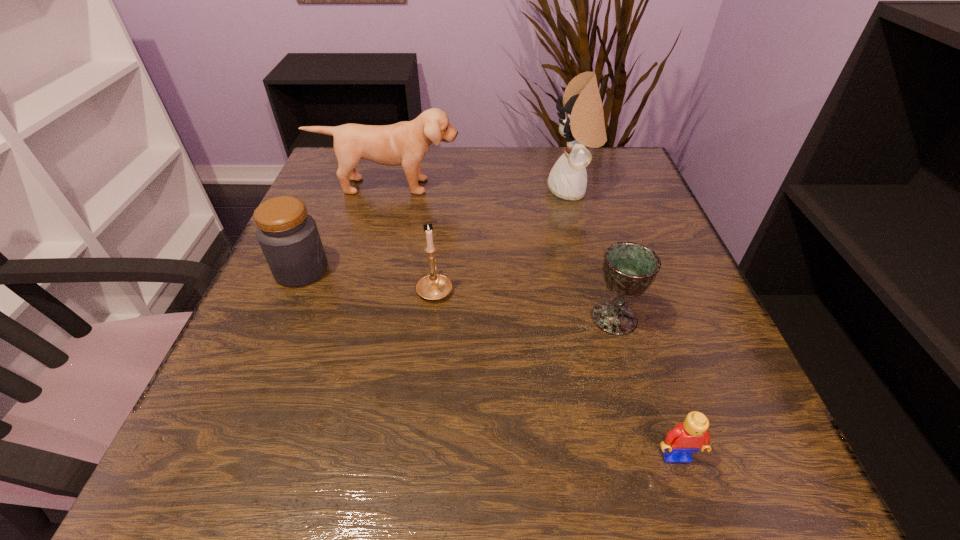
Find the location of a particular element. free space between the doll and the chalice is located at coordinates (593, 254).

Identify the location of free spot between the fifth shortest object and the candle holder. (412, 237).

Where is `the third closest object to the candle holder`? This screenshot has height=540, width=960. the third closest object to the candle holder is located at coordinates (405, 143).

Identify which object is the nearest to the doll. Please provide its 2D coordinates. Your answer should be formatted as a tuple, i.e. [(x, y)], where the tuple contains the x and y coordinates of a point satisfying the conditions above.

[(405, 143)]

Where is `blank space that satisfies the following two spatial constraints: 1. on the surface of the jar near the warning symbol; 2. on the right side of the chalice`? The image size is (960, 540). blank space that satisfies the following two spatial constraints: 1. on the surface of the jar near the warning symbol; 2. on the right side of the chalice is located at coordinates (281, 318).

Where is `vacant space that satisfies the following two spatial constraints: 1. on the handle side of the candle holder; 2. on the surface of the jar near the warning symbol`? vacant space that satisfies the following two spatial constraints: 1. on the handle side of the candle holder; 2. on the surface of the jar near the warning symbol is located at coordinates (437, 270).

Locate an element on the screen. This screenshot has height=540, width=960. vacant area that satisfies the following two spatial constraints: 1. at the front face of the doll; 2. on the right side of the chalice is located at coordinates (606, 318).

Identify the location of vacant space that satisfies the following two spatial constraints: 1. on the left side of the second tallest object; 2. on the right side of the chalice. The image size is (960, 540). (352, 318).

At what (x,y) coordinates should I click in order to perform the action: click on vacant space that satisfies the following two spatial constraints: 1. on the handle side of the candle holder; 2. on the surface of the jar near the warning symbol. Please return your answer as a coordinate pair (x, y). Looking at the image, I should click on (x=437, y=270).

Identify the location of vacant space that satisfies the following two spatial constraints: 1. on the back side of the chalice; 2. at the front face of the doll. (578, 191).